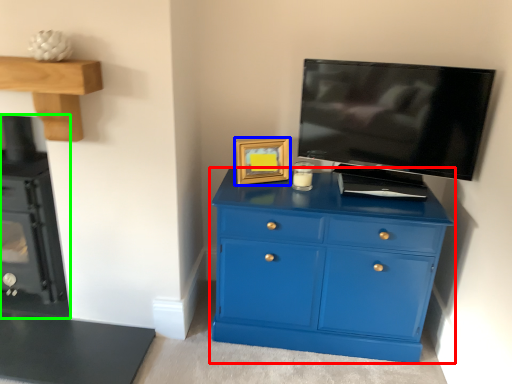
Question: Based on their relative distances, which object is nearer to chest of drawers (highlighted by a red box)? Choose from picture frame (highlighted by a blue box) and appliance (highlighted by a green box).

Choices:
 (A) picture frame
 (B) appliance

Answer: (A)